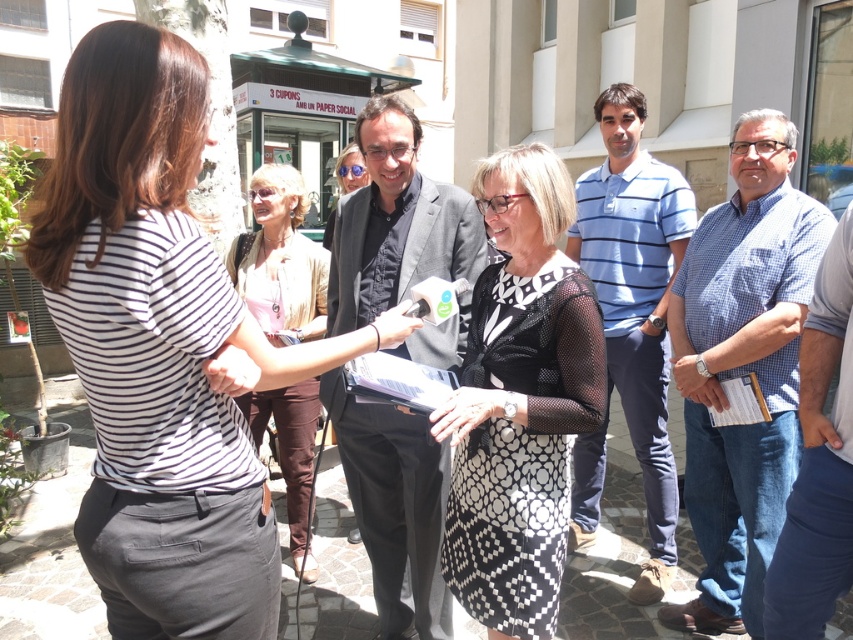
You are a photographer positioned at the center of the scene. You need to capture a photo that includes both the woman with the microphone and the black matte suit at center. Based on their positions, can you frame the shot so that both subjects are visible in the same frame?

The black matte suit at center is located at point (x=396, y=224), which is near the center of the scene. Since the photographer is also at the center, adjusting the camera angle slightly should allow both the woman with the microphone and the black matte suit at center to be included in the frame.